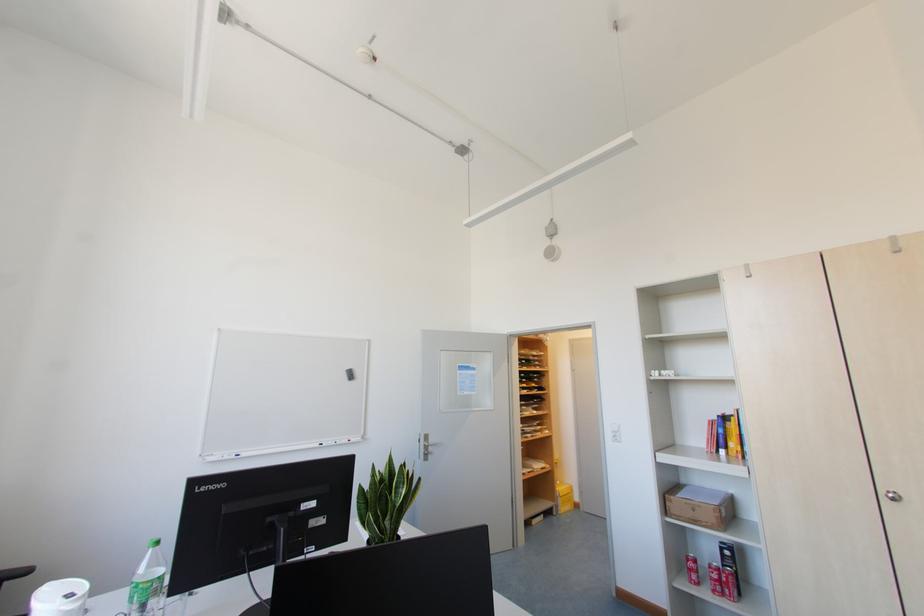
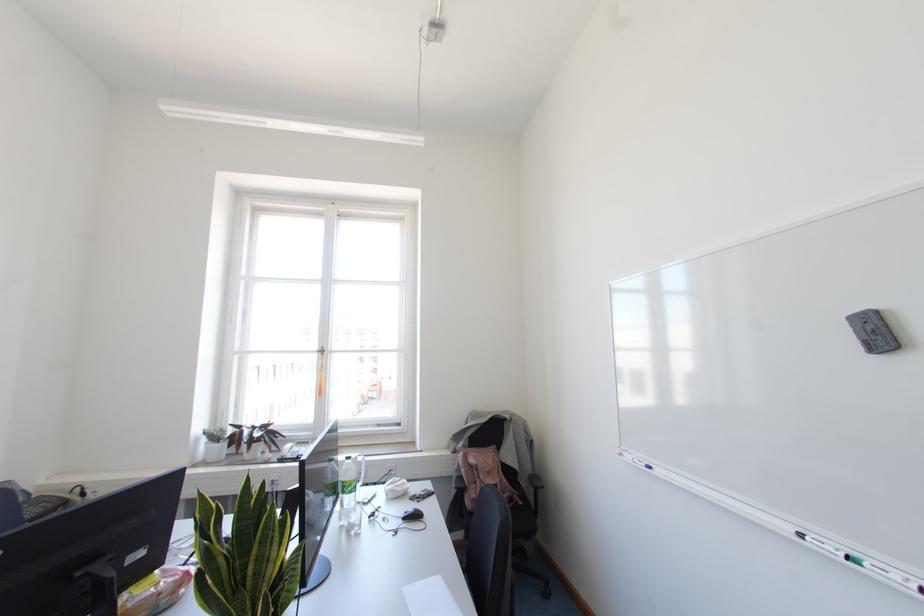
In the second image, find the point that corresponds to pixel 237 455 in the first image.

(649, 467)